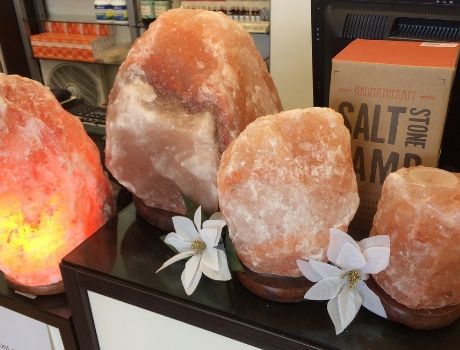
Locate an element on the screen. Image resolution: width=460 pixels, height=350 pixels. black counter is located at coordinates (127, 248), (381, 338), (47, 309).